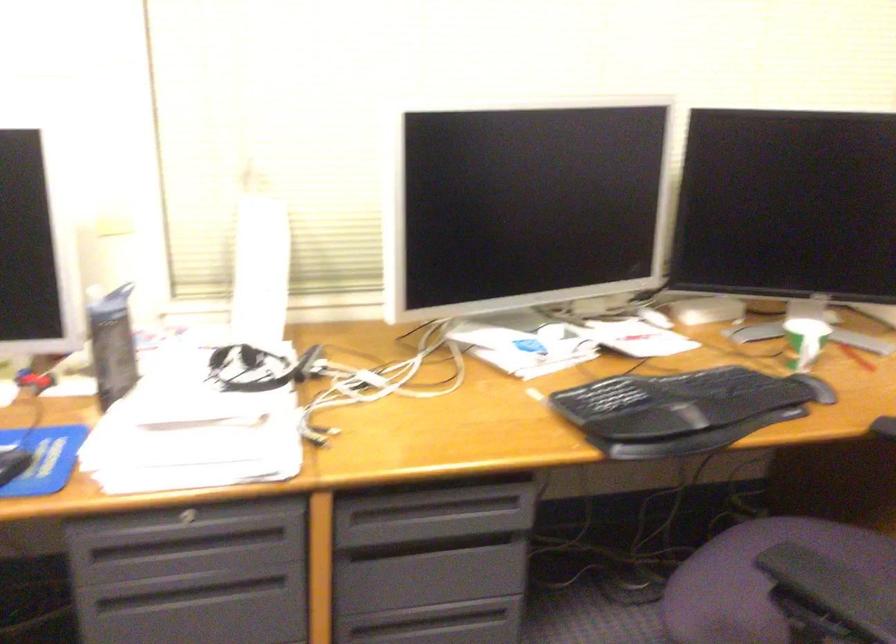
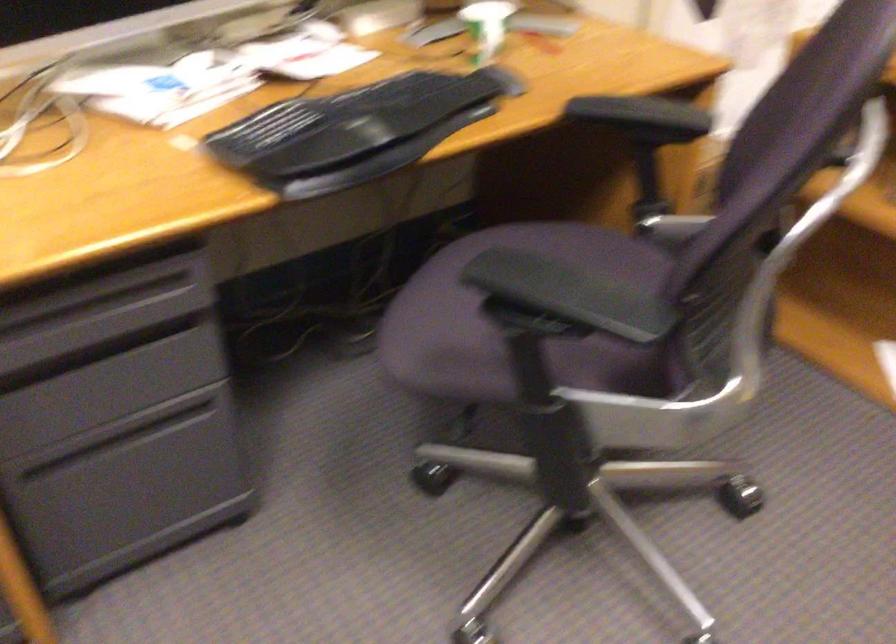
Based on the photo, which direction would the cameraman need to move to produce the second image?

The cameraman moved toward right, forward.